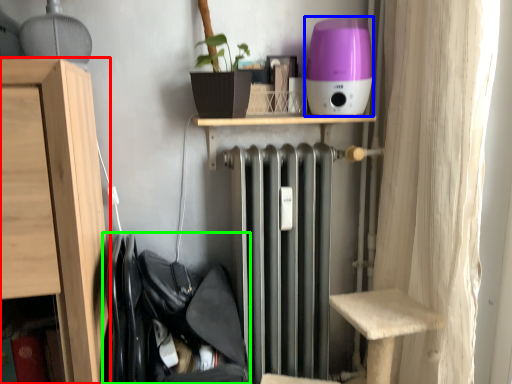
Question: Which is nearer to the furniture (highlighted by a red box)? appliance (highlighted by a blue box) or laundry (highlighted by a green box).

Choices:
 (A) appliance
 (B) laundry

Answer: (B)